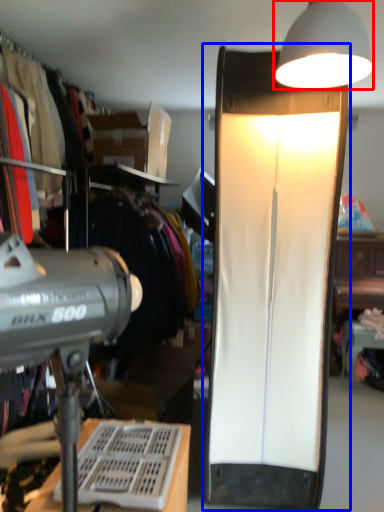
Question: Which object appears closest to the camera in this image, lamp (highlighted by a red box) or lamp (highlighted by a blue box)?

Choices:
 (A) lamp
 (B) lamp

Answer: (A)